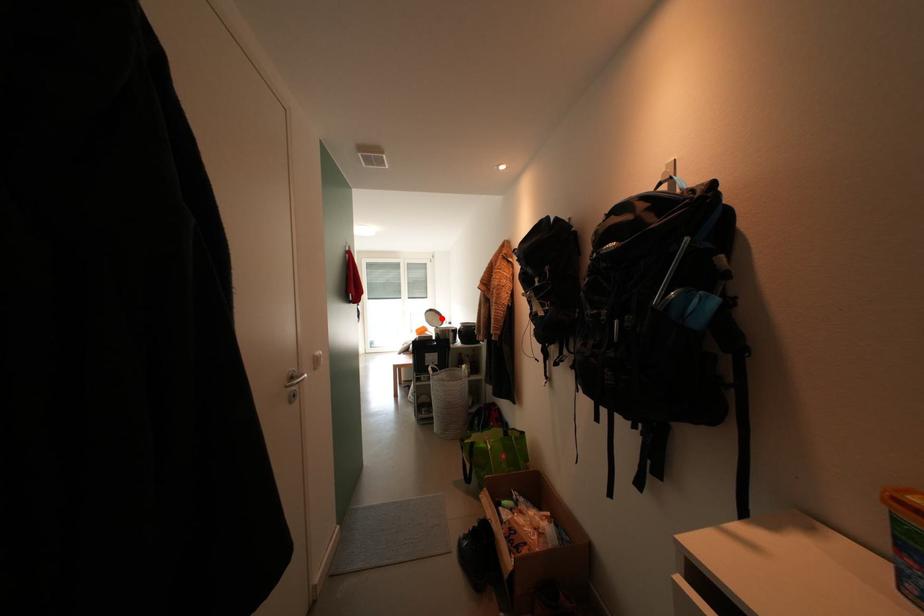
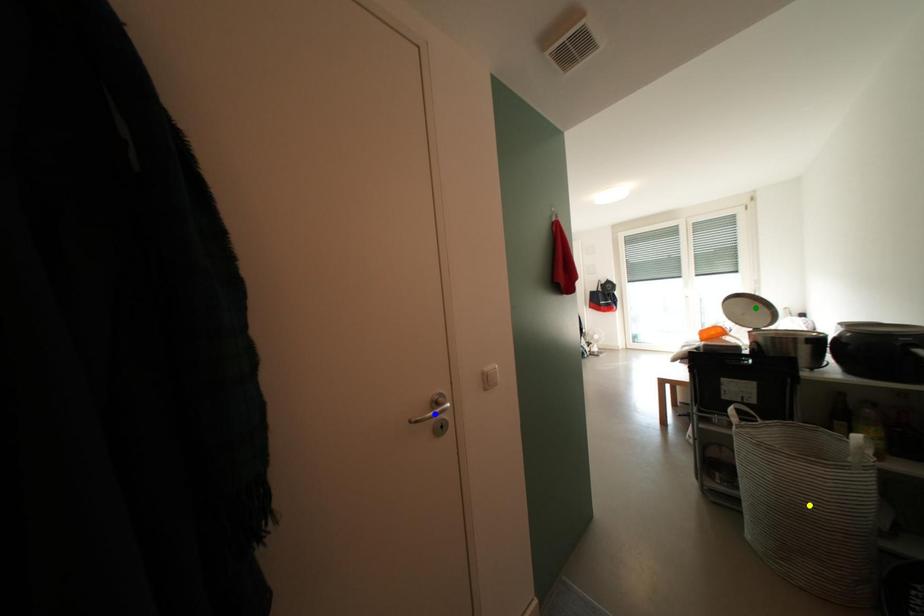
Question: I am providing you with two images of the same scene from different viewpoints. A red point is marked on the first image. You are given multiple points on the second image. Which spot in image 2 lines up with the point in image 1?

Choices:
 (A) blue point
 (B) green point
 (C) yellow point

Answer: (B)